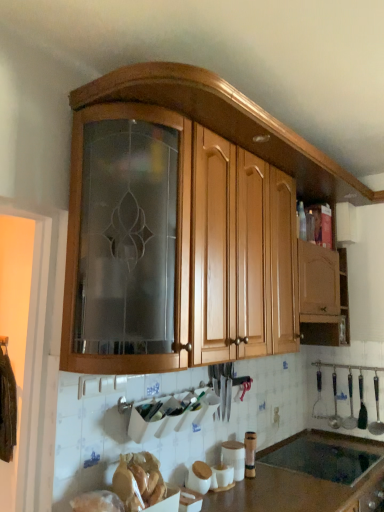
Find the location of a particular element. The height and width of the screenshot is (512, 384). vacant space positioned to the left of polished metal ladle at right, positioned as the first silverware in right-to-left order is located at coordinates (352, 440).